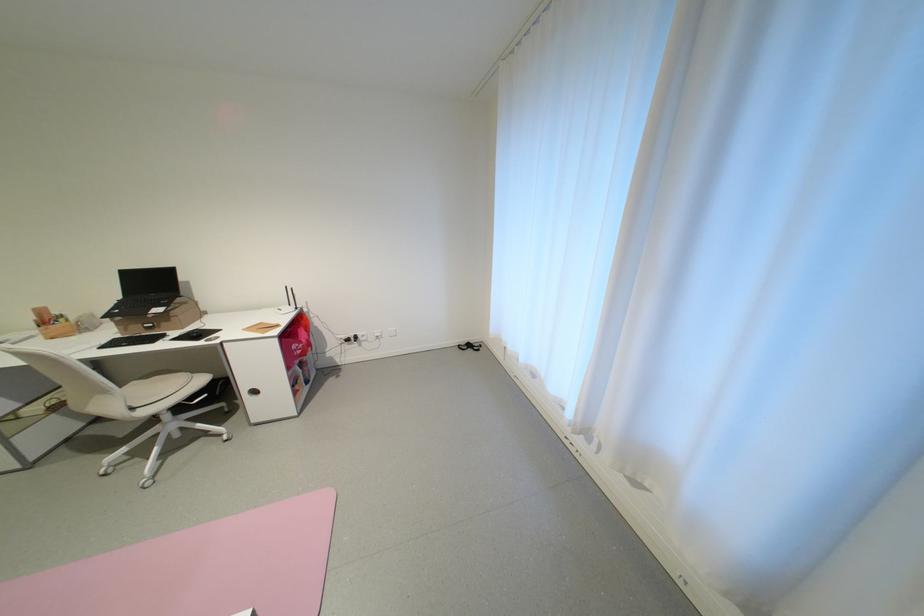
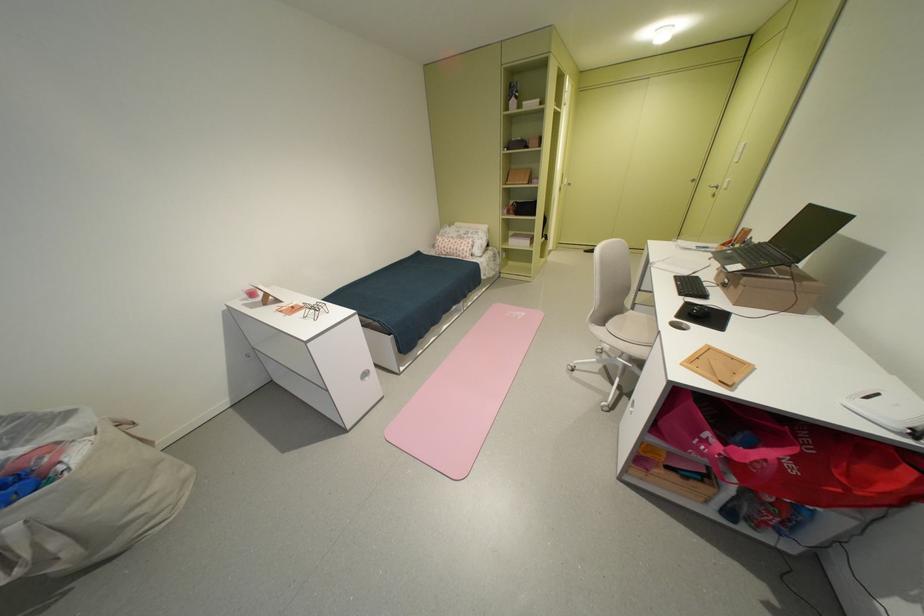
Locate, in the second image, the point that corresponds to (265,326) in the first image.

(743, 360)